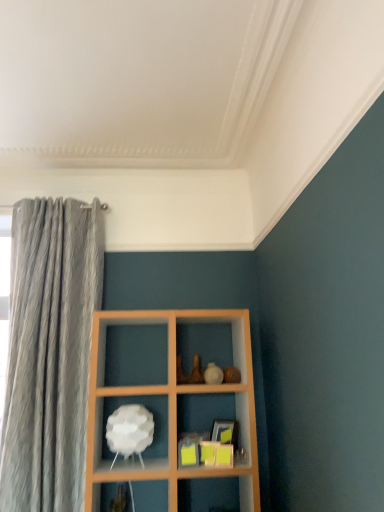
Identify the location of white matte lamp at center. The width and height of the screenshot is (384, 512). (146, 449).

The height and width of the screenshot is (512, 384). What do you see at coordinates (146, 449) in the screenshot?
I see `white matte lamp at center` at bounding box center [146, 449].

Measure the distance between point (161, 426) and camera.

Point (161, 426) and camera are 7.55 feet apart.

Where is `white matte lamp at center`? The height and width of the screenshot is (512, 384). white matte lamp at center is located at coordinates (146, 449).